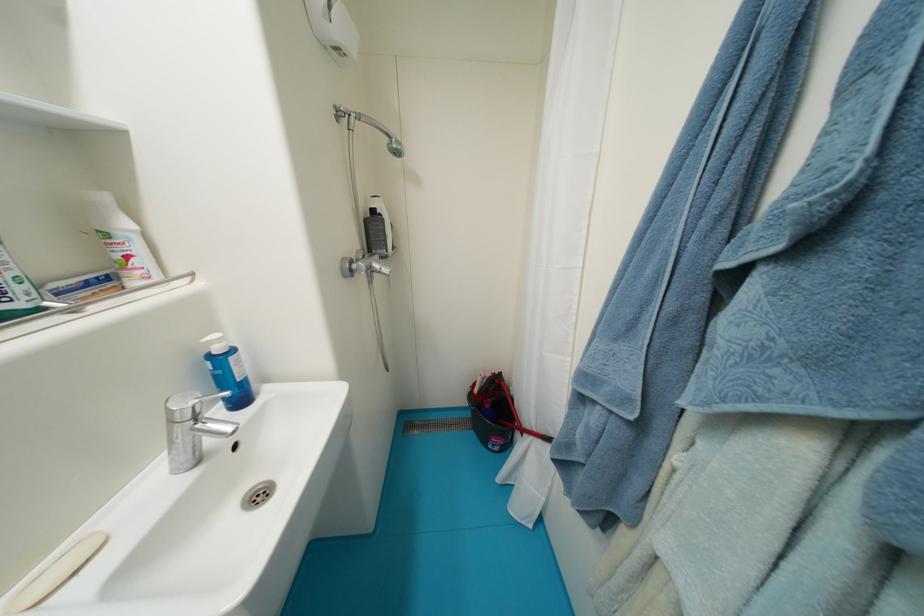
I want to click on silver shower head, so click(x=367, y=217).